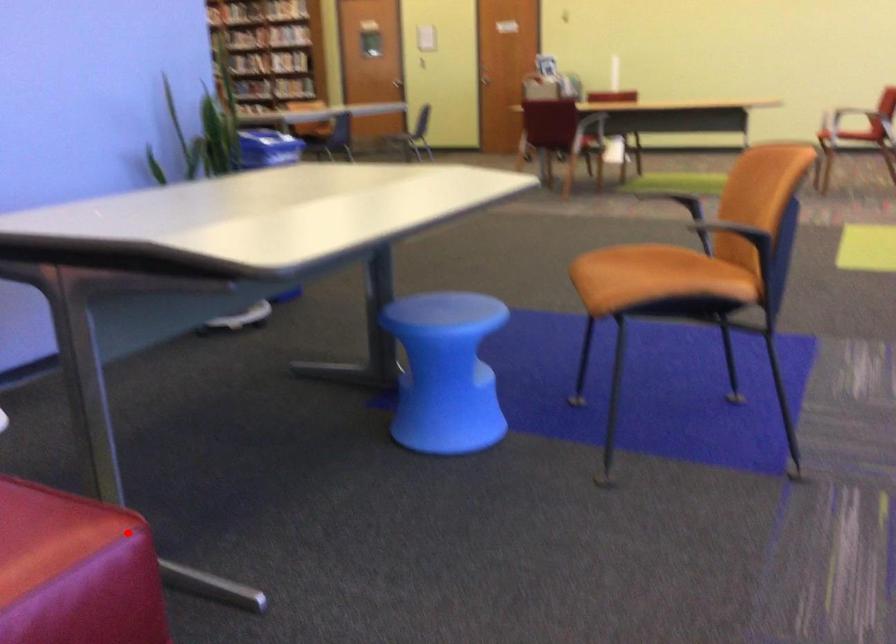
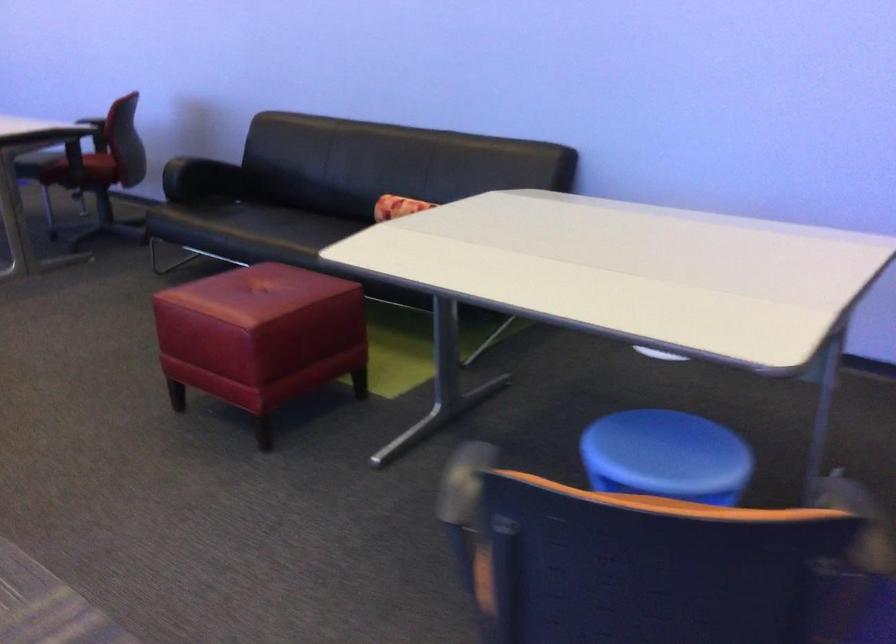
Question: I am providing you with two images of the same scene from different viewpoints. Image1 has a red point marked. In image2, the corresponding 3D location appears at what relative position? Reply with the corresponding letter.

Choices:
 (A) Closer
 (B) Farther

Answer: (B)